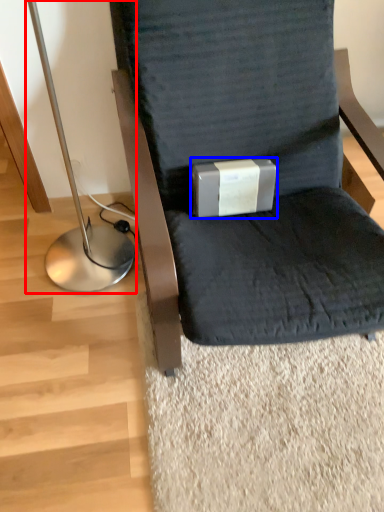
Question: Among these objects, which one is farthest to the camera, bedside lamp (highlighted by a red box) or box (highlighted by a blue box)?

Choices:
 (A) bedside lamp
 (B) box

Answer: (B)